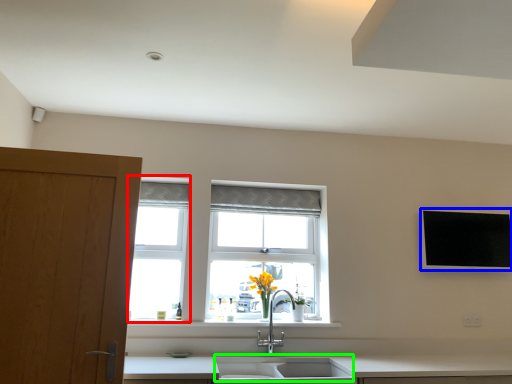
Question: Considering the real-world distances, which object is closest to window frame (highlighted by a red box)? flat (highlighted by a blue box) or sink (highlighted by a green box).

Choices:
 (A) flat
 (B) sink

Answer: (B)